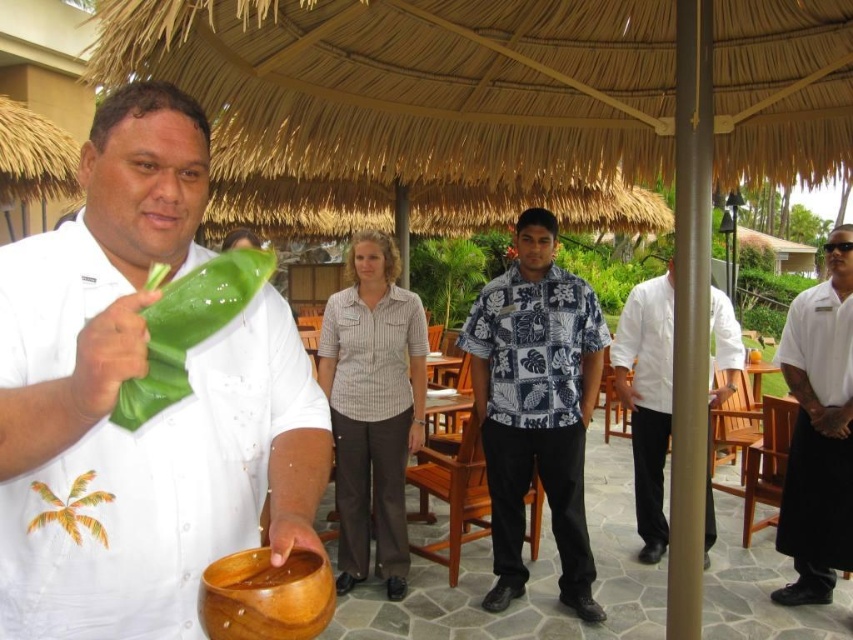
Question: Does blue printed shirt at center appear under wooden bowl at lower center?

Choices:
 (A) yes
 (B) no

Answer: (A)

Question: Estimate the real-world distances between objects in this image. Which object is farther from the white shirt at center?

Choices:
 (A) wooden bowl at lower center
 (B) brown wooden bowl at lower center
 (C) white matte shirt at center
 (D) blue printed shirt at center

Answer: (B)

Question: Does blue printed shirt at center come behind brown wooden bowl at lower center?

Choices:
 (A) yes
 (B) no

Answer: (A)

Question: Which of the following is the farthest from the observer?

Choices:
 (A) white shirt at center
 (B) wooden bowl at lower center
 (C) white matte shirt at center

Answer: (A)

Question: Estimate the real-world distances between objects in this image. Which object is closer to the white matte shirt at center?

Choices:
 (A) green leafy at center
 (B) blue printed shirt at center
 (C) white shirt at center

Answer: (A)

Question: Can you confirm if white glossy shirt at center is bigger than brown wooden bowl at lower center?

Choices:
 (A) yes
 (B) no

Answer: (A)